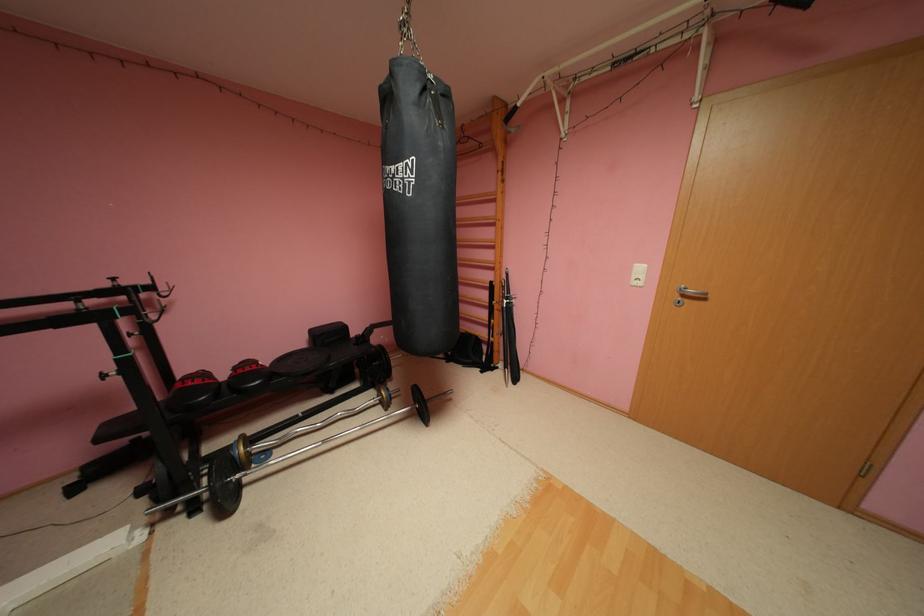
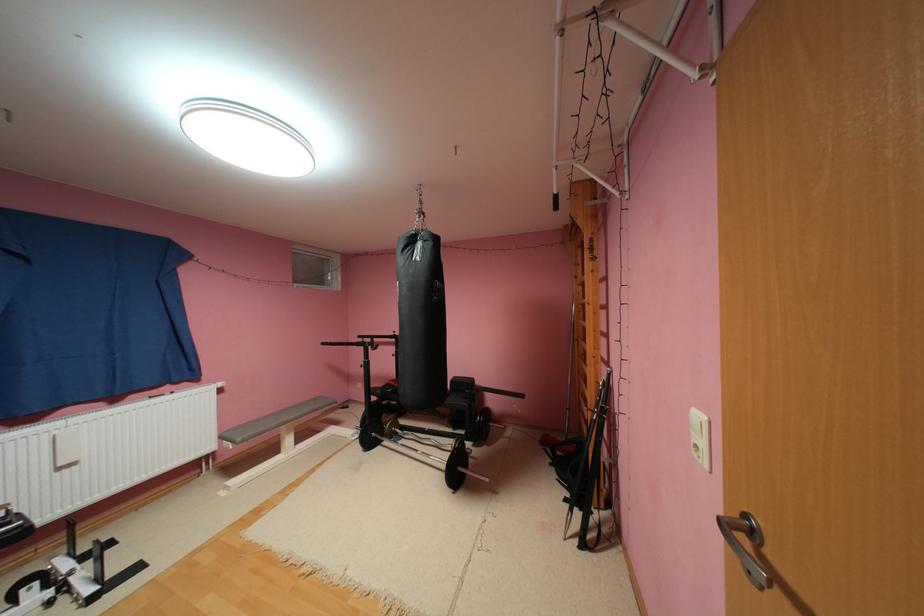
Locate, in the second image, the point that corresponds to pixel 491 371 in the first image.

(575, 500)